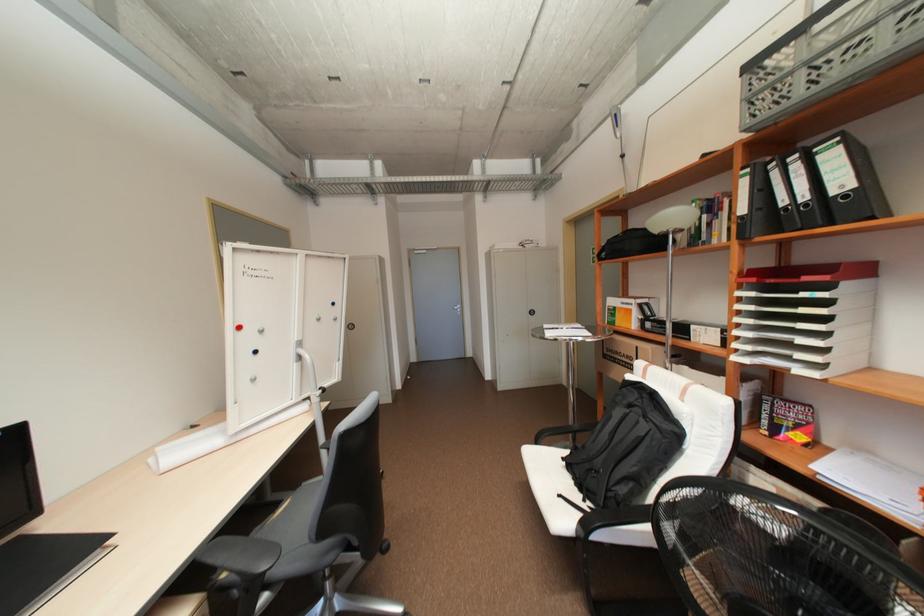
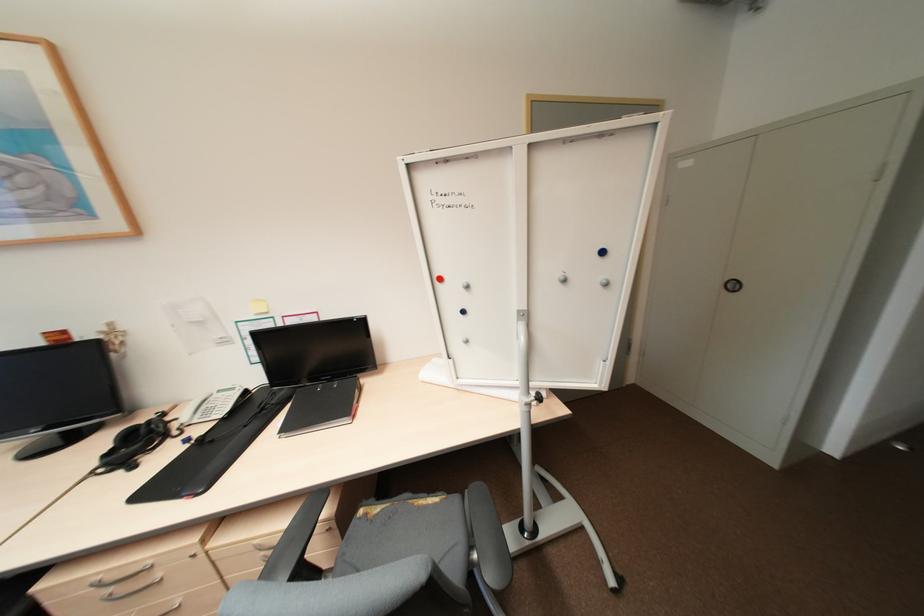
Where in the second image is the point corresponding to point 341,318 from the first image?

(612, 284)